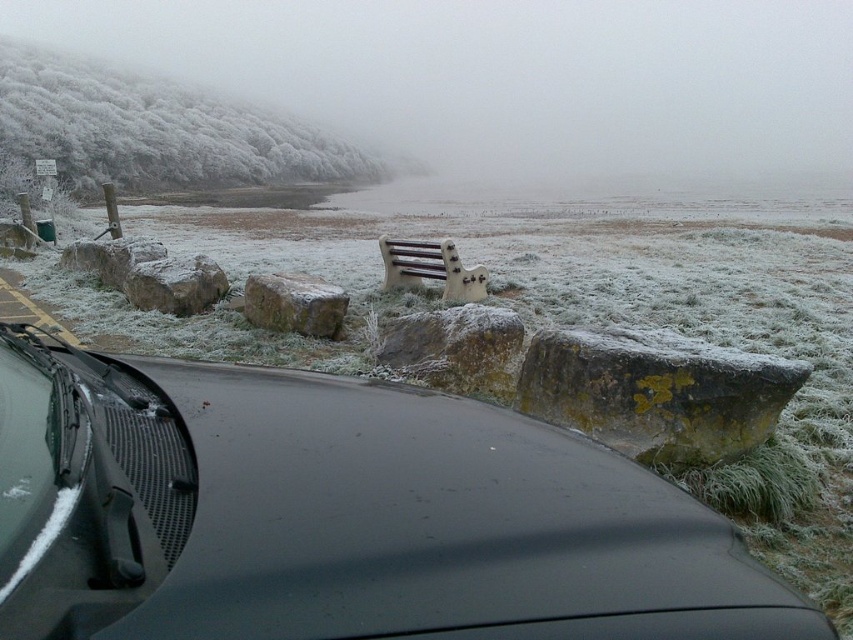
Question: Which point is farther to the camera?

Choices:
 (A) clear glass windshield at lower left
 (B) brown rough stone at center
 (C) glossy black car at lower center

Answer: (B)

Question: Is sandy brown rock at left below white painted wood bench at center?

Choices:
 (A) yes
 (B) no

Answer: (A)

Question: Among these points, which one is nearest to the camera?

Choices:
 (A) (451, 268)
 (B) (482, 547)
 (C) (345, 296)
 (D) (660, 456)

Answer: (B)

Question: Does clear glass windshield at lower left appear on the right side of brown rough stone at center?

Choices:
 (A) no
 (B) yes

Answer: (B)

Question: Considering the real-world distances, which object is closest to the white painted wood bench at center?

Choices:
 (A) brown rough stone at center
 (B) glossy black car at lower center

Answer: (A)

Question: Is clear glass windshield at lower left positioned at the back of yellow-green mossy rock at right?

Choices:
 (A) yes
 (B) no

Answer: (B)